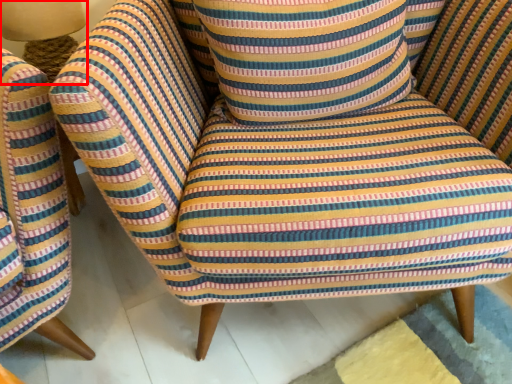
Question: Considering the relative positions of table lamp (annotated by the red box) and throw pillow in the image provided, where is table lamp (annotated by the red box) located with respect to the staircase?

Choices:
 (A) left
 (B) right

Answer: (A)